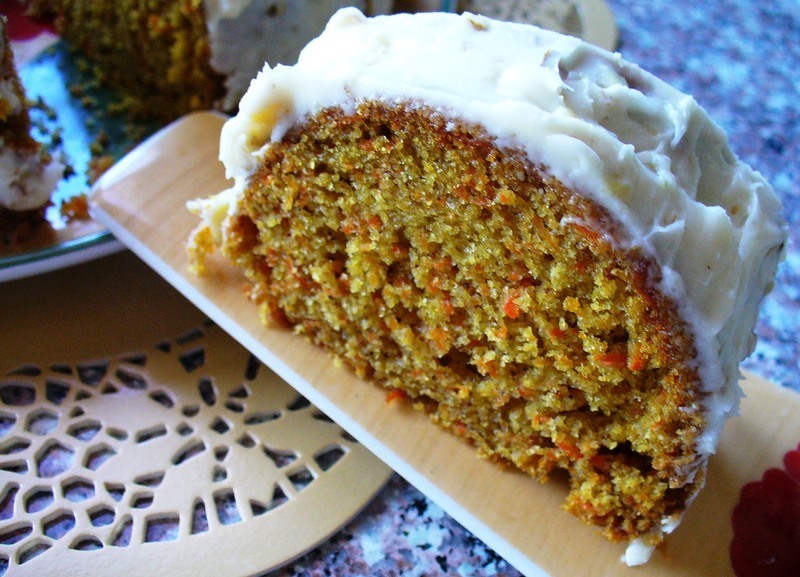
Locate an element on the screen. plate is located at coordinates (126, 402).